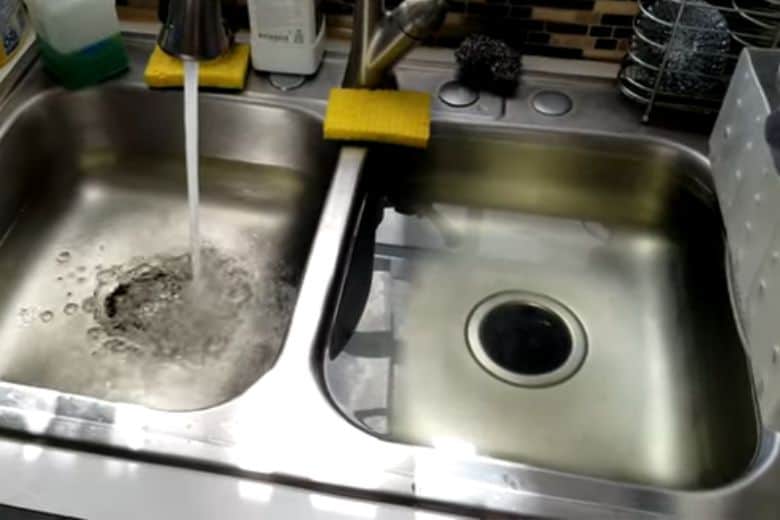
Locate an element on the screen. The width and height of the screenshot is (780, 520). silver counter is located at coordinates (267, 508).